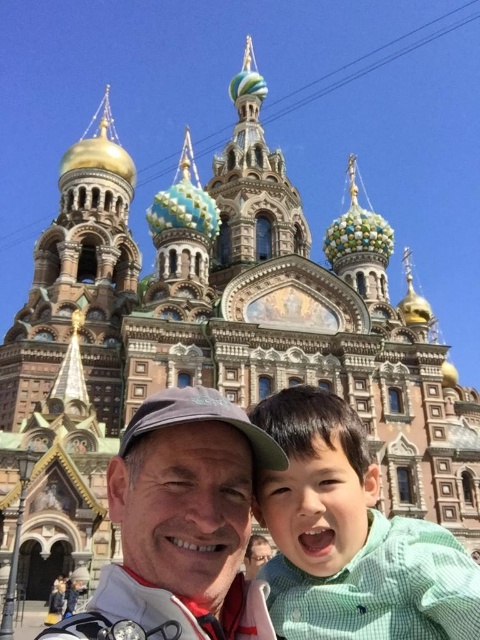
Question: Does green textured shirt at center appear on the left side of matte gray cap at center?

Choices:
 (A) no
 (B) yes

Answer: (A)

Question: Which of the following is the closest to the observer?

Choices:
 (A) green textured shirt at center
 (B) matte gray cap at center

Answer: (B)

Question: Is green textured shirt at center to the left of matte gray cap at center from the viewer's perspective?

Choices:
 (A) yes
 (B) no

Answer: (B)

Question: From the image, what is the correct spatial relationship of green textured shirt at center in relation to matte gray cap at center?

Choices:
 (A) left
 (B) right

Answer: (B)

Question: Which of the following is the farthest from the observer?

Choices:
 (A) green textured shirt at center
 (B) matte gray cap at center

Answer: (A)